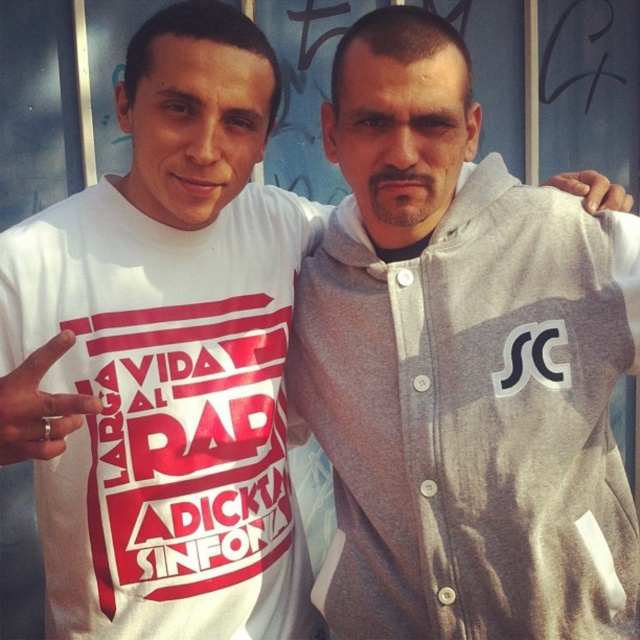
How distant is gray fleece sweatshirt at center from white matte t-shirt at left?

A distance of 13.83 inches exists between gray fleece sweatshirt at center and white matte t-shirt at left.

Who is lower down, gray fleece sweatshirt at center or white matte t-shirt at left?

gray fleece sweatshirt at center

Identify the location of gray fleece sweatshirt at center. The width and height of the screenshot is (640, 640). (474, 417).